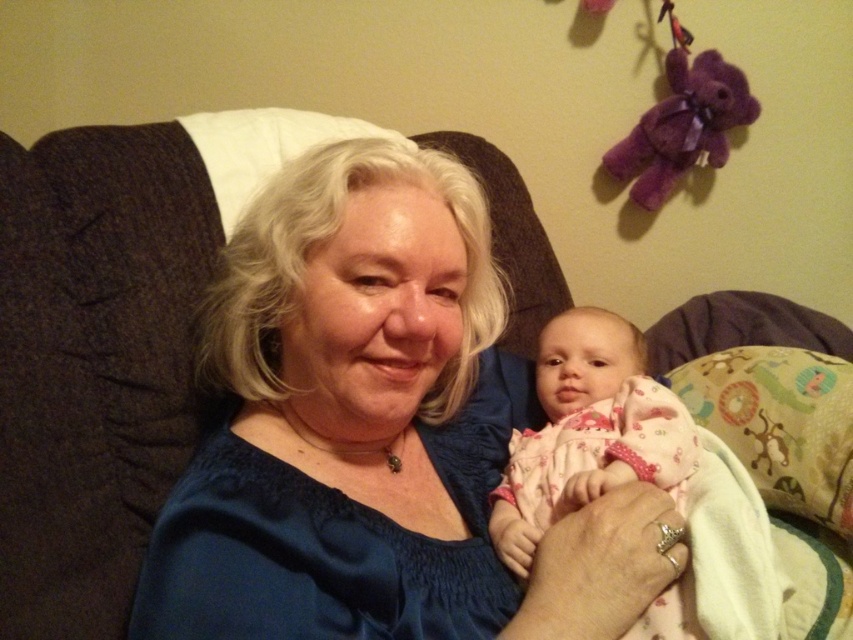
Is blue satin blouse at center further to camera compared to pink cotton baby at center?

No.

Identify the location of blue satin blouse at center. The height and width of the screenshot is (640, 853). (374, 433).

Between point (613, 570) and point (596, 492), which one is positioned in front?

Point (613, 570) is more forward.

You are a GUI agent. You are given a task and a screenshot of the screen. Output one action in this format:
    pyautogui.click(x=<x>, y=<y>)
    Task: Click on the blue satin blouse at center
    
    Given the screenshot: What is the action you would take?
    pyautogui.click(x=374, y=433)